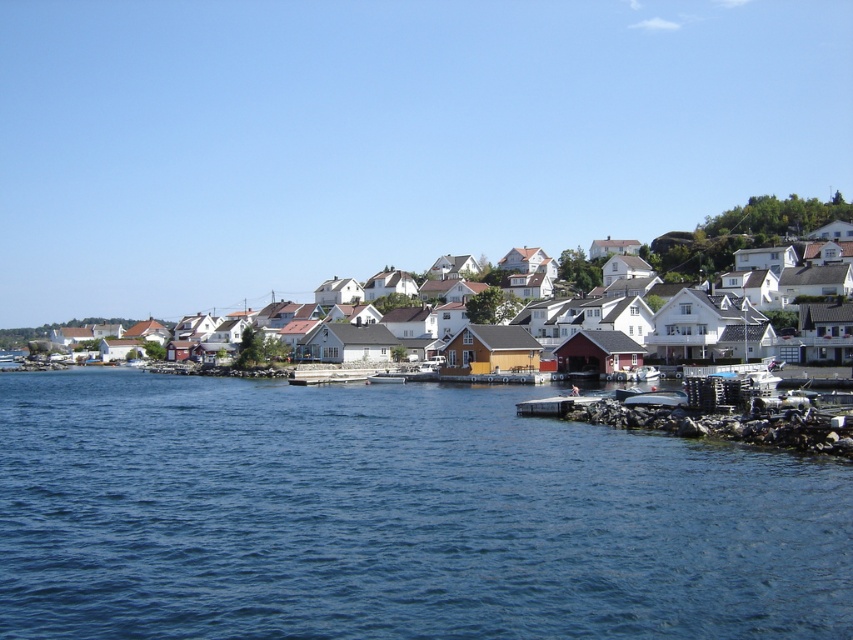
Between white wooden houses at center and metallic gray boat at lower right, which one is positioned lower?

Positioned lower is metallic gray boat at lower right.

Is white wooden houses at center shorter than metallic gray boat at lower right?

No, white wooden houses at center is not shorter than metallic gray boat at lower right.

Does point (830, 221) come in front of point (631, 403)?

No, it is behind (631, 403).

Find the location of a particular element. The width and height of the screenshot is (853, 640). white wooden houses at center is located at coordinates (756, 256).

Which is behind, point (795, 291) or point (560, 410)?

Positioned behind is point (795, 291).

Does white wooden houses at center have a greater height compared to smooth concrete dock at lower center?

Indeed, white wooden houses at center has a greater height compared to smooth concrete dock at lower center.

The width and height of the screenshot is (853, 640). Find the location of `white wooden houses at center`. white wooden houses at center is located at coordinates (756, 256).

Is blue water at lower center wider than white wooden houses at center?

No.

Can you confirm if blue water at lower center is positioned below white wooden houses at center?

Yes.

Locate an element on the screen. The width and height of the screenshot is (853, 640). blue water at lower center is located at coordinates (395, 516).

You are a GUI agent. You are given a task and a screenshot of the screen. Output one action in this format:
    pyautogui.click(x=<x>, y=<y>)
    Task: Click on the blue water at lower center
    The width and height of the screenshot is (853, 640).
    Given the screenshot: What is the action you would take?
    pyautogui.click(x=395, y=516)